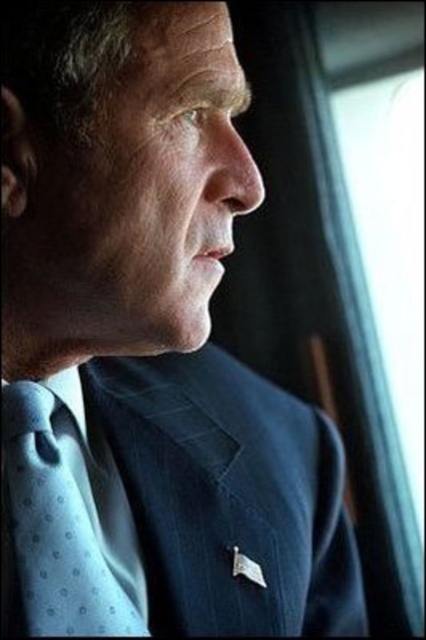
Question: Which object is farther from the camera taking this photo?

Choices:
 (A) dark blue textured suit at center
 (B) light blue dotted fabric tie at center

Answer: (A)

Question: Can you confirm if dark blue textured suit at center is smaller than light blue dotted fabric tie at center?

Choices:
 (A) yes
 (B) no

Answer: (B)

Question: Does dark blue textured suit at center have a greater width compared to light blue dotted fabric tie at center?

Choices:
 (A) no
 (B) yes

Answer: (B)

Question: Is dark blue textured suit at center to the left of light blue dotted fabric tie at center from the viewer's perspective?

Choices:
 (A) yes
 (B) no

Answer: (B)

Question: Which point is closer to the camera?

Choices:
 (A) (106, 557)
 (B) (233, 538)

Answer: (A)

Question: Which object appears closest to the camera in this image?

Choices:
 (A) dark blue textured suit at center
 (B) light blue dotted fabric tie at center

Answer: (B)